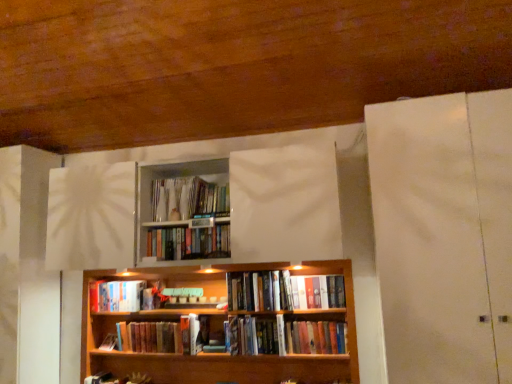
Question: Considering the positions of white matte door at right and hardcover book at center, acting as the 5th book starting from the bottom, in the image, is white matte door at right bigger or smaller than hardcover book at center, acting as the 5th book starting from the bottom,?

Choices:
 (A) big
 (B) small

Answer: (A)

Question: In the image, is white matte door at right positioned in front of or behind hardcover book at center, the 3th book from the top?

Choices:
 (A) behind
 (B) front

Answer: (B)

Question: Estimate the real-world distances between objects in this image. Which object is closer to the hardcover book at center, acting as the 5th book starting from the bottom?

Choices:
 (A) hardcover book at center, acting as the 7th book starting from the top
 (B) white matte door at right
 (C) matte plastic books at upper center, which is the 1th book in top-to-bottom order
 (D) hardcover book at center, arranged as the 5th book when viewed from the top
 (E) hardcover books at center, which is the second book in bottom-to-top order

Answer: (E)

Question: Which is farther from the wooden bookcase at center?

Choices:
 (A) hardcover book at center, acting as the 5th book starting from the bottom
 (B) hardcover book at center, arranged as the 5th book when viewed from the top
 (C) matte plastic books at upper center, which is the 1th book in top-to-bottom order
 (D) hardcover book at center, acting as the 7th book starting from the top
 (E) white matte door at right

Answer: (E)